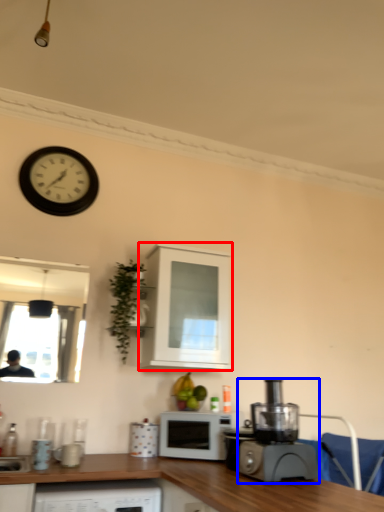
Question: Which of the following is the farthest to the observer, cabinetry (highlighted by a red box) or home appliance (highlighted by a blue box)?

Choices:
 (A) cabinetry
 (B) home appliance

Answer: (A)